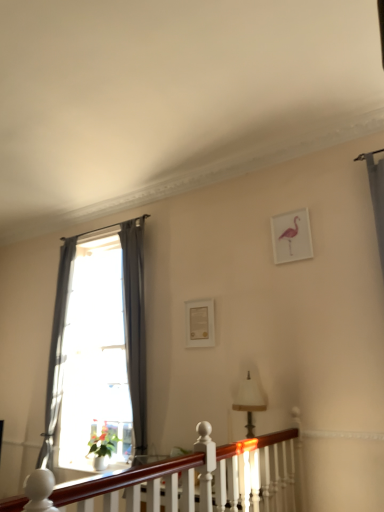
Describe the element at coordinates (103, 443) in the screenshot. Image resolution: width=384 pixels, height=512 pixels. I see `green matte flower at lower left` at that location.

Measure the distance between point (309,252) and camera.

The depth of point (309,252) is 3.41 meters.

Identify the location of matte white picture frame at center, which ranks as the 1th picture frame in back-to-front order. (199, 323).

What do you see at coordinates (98, 347) in the screenshot? The image size is (384, 512). I see `transparent glass window at left` at bounding box center [98, 347].

This screenshot has width=384, height=512. What are the coordinates of `white fabric lampshade at center` in the screenshot? It's located at (249, 402).

Measure the distance between white fabric lampshade at center and camera.

They are 3.19 meters apart.

Locate an element on the screen. The image size is (384, 512). gray fabric curtain at left, which is counted as the 2th curtain, starting from the left is located at coordinates (135, 325).

Considering the sizes of pink matte picture frame at upper right, which is the 2th picture frame from left to right, and transparent glass window at left in the image, is pink matte picture frame at upper right, which is the 2th picture frame from left to right, wider or thinner than transparent glass window at left?

In the image, pink matte picture frame at upper right, which is the 2th picture frame from left to right, appears to be more narrow than transparent glass window at left.

Is pink matte picture frame at upper right, the 1th picture frame in the front-to-back sequence, positioned behind transparent glass window at left?

No, pink matte picture frame at upper right, the 1th picture frame in the front-to-back sequence, is closer to the viewer.

Where is `the 2nd picture frame above the transparent glass window at left (from the image's perspective)`? The height and width of the screenshot is (512, 384). the 2nd picture frame above the transparent glass window at left (from the image's perspective) is located at coordinates (291, 236).

From the image's perspective, who appears lower, mahogany wood balustrade at lower center or gray fabric curtain at left, the 1th curtain when ordered from left to right?

mahogany wood balustrade at lower center appears lower in the image.

Which curtain is the 2nd one when counting from the back of the mahogany wood balustrade at lower center? Please provide its 2D coordinates.

[(57, 353)]

From a real-world perspective, is mahogany wood balustrade at lower center located beneath gray fabric curtain at left, the 1th curtain when ordered from left to right?

Yes, from a real-world perspective, mahogany wood balustrade at lower center is beneath gray fabric curtain at left, the 1th curtain when ordered from left to right.

Between mahogany wood balustrade at lower center and pink matte picture frame at upper right, the 1th picture frame in the front-to-back sequence, which one has larger size?

Bigger between the two is mahogany wood balustrade at lower center.

Which object is further away from the camera taking this photo, mahogany wood balustrade at lower center or pink matte picture frame at upper right, placed as the 1th picture frame when sorted from right to left?

pink matte picture frame at upper right, placed as the 1th picture frame when sorted from right to left, is further away from the camera.

Image resolution: width=384 pixels, height=512 pixels. I want to click on the 1st picture frame behind the mahogany wood balustrade at lower center, counting from the anchor's position, so click(291, 236).

Are green matte flower at lower left and transparent glass window at left far apart?

They are positioned close to each other.

Is point (110, 435) closer to viewer compared to point (111, 309)?

Yes, it is in front of point (111, 309).

Is green matte flower at lower left bigger or smaller than transparent glass window at left?

Clearly, green matte flower at lower left is smaller in size than transparent glass window at left.

Which is behind, green matte flower at lower left or transparent glass window at left?

transparent glass window at left is further from the camera.

Does pink matte picture frame at upper right, the 1th picture frame in the front-to-back sequence, have a lesser height compared to gray fabric curtain at left, the second curtain in the right-to-left sequence?

Correct, pink matte picture frame at upper right, the 1th picture frame in the front-to-back sequence, is not as tall as gray fabric curtain at left, the second curtain in the right-to-left sequence.

Which is behind, point (282, 245) or point (74, 258)?

The point (74, 258) is behind.

How far apart are pink matte picture frame at upper right, the 1th picture frame in the front-to-back sequence, and gray fabric curtain at left, the 1th curtain when ordered from left to right?

pink matte picture frame at upper right, the 1th picture frame in the front-to-back sequence, is 9.21 feet away from gray fabric curtain at left, the 1th curtain when ordered from left to right.

Is pink matte picture frame at upper right, which ranks as the 2th picture frame in bottom-to-top order, inside or outside of gray fabric curtain at left, the second curtain in the right-to-left sequence?

pink matte picture frame at upper right, which ranks as the 2th picture frame in bottom-to-top order, is located beyond the bounds of gray fabric curtain at left, the second curtain in the right-to-left sequence.

Who is smaller, gray fabric curtain at left, the second curtain in the right-to-left sequence, or matte white picture frame at center, placed as the second picture frame when sorted from top to bottom?

With smaller size is matte white picture frame at center, placed as the second picture frame when sorted from top to bottom.

Is gray fabric curtain at left, the second curtain in the right-to-left sequence, not inside matte white picture frame at center, which is the second picture frame from right to left?

Yes, gray fabric curtain at left, the second curtain in the right-to-left sequence, is outside of matte white picture frame at center, which is the second picture frame from right to left.

Can you see gray fabric curtain at left, the 1th curtain when ordered from left to right, touching matte white picture frame at center, which ranks as the 1th picture frame in back-to-front order?

gray fabric curtain at left, the 1th curtain when ordered from left to right, and matte white picture frame at center, which ranks as the 1th picture frame in back-to-front order, are not in contact.

How far apart are gray fabric curtain at left, the 1th curtain when ordered from left to right, and pink matte picture frame at upper right, which ranks as the 2th picture frame in bottom-to-top order?

gray fabric curtain at left, the 1th curtain when ordered from left to right, and pink matte picture frame at upper right, which ranks as the 2th picture frame in bottom-to-top order, are 9.21 feet apart from each other.

Locate an element on the screen. This screenshot has width=384, height=512. the 2nd curtain behind the pink matte picture frame at upper right, which ranks as the 2th picture frame in bottom-to-top order, counting from the anchor's position is located at coordinates (57, 353).

Is gray fabric curtain at left, the 1th curtain when ordered from left to right, bigger than pink matte picture frame at upper right, the 1th picture frame positioned from the top?

Yes.

Considering the positions of points (51, 420) and (306, 255), is point (51, 420) farther from camera compared to point (306, 255)?

That is True.

What are the coordinates of `window below the pink matte picture frame at upper right, the 1th picture frame in the front-to-back sequence (from the image's perspective)` in the screenshot? It's located at (98, 347).

Where is `the 1st curtain located above the mahogany wood balustrade at lower center (from a real-world perspective)`? This screenshot has width=384, height=512. the 1st curtain located above the mahogany wood balustrade at lower center (from a real-world perspective) is located at coordinates (57, 353).

From the image, which object appears to be farther from transparent glass window at left, white fabric lampshade at center or matte white picture frame at center, marked as the first picture frame in a bottom-to-top arrangement?

The object further to transparent glass window at left is white fabric lampshade at center.

Which object lies nearer to the anchor point transparent glass window at left, mahogany wood balustrade at lower center or white fabric lampshade at center?

Based on the image, white fabric lampshade at center appears to be nearer to transparent glass window at left.

Which object lies nearer to the anchor point gray fabric curtain at left, the second curtain in the right-to-left sequence, gray fabric curtain at left, which is counted as the 2th curtain, starting from the left, or transparent glass window at left?

transparent glass window at left lies closer to gray fabric curtain at left, the second curtain in the right-to-left sequence, than the other object.

Looking at the image, which one is located closer to pink matte picture frame at upper right, which is the 2th picture frame from left to right, gray fabric curtain at left, acting as the 1th curtain starting from the right, or matte white picture frame at center, which is the first picture frame in left-to-right order?

matte white picture frame at center, which is the first picture frame in left-to-right order.

Looking at the image, which one is located closer to green matte flower at lower left, gray fabric curtain at left, which is counted as the 2th curtain, starting from the left, or gray fabric curtain at left, the 1th curtain when ordered from left to right?

The object closer to green matte flower at lower left is gray fabric curtain at left, which is counted as the 2th curtain, starting from the left.

Looking at the image, which one is located further to gray fabric curtain at left, acting as the 1th curtain starting from the right, transparent glass window at left or mahogany wood balustrade at lower center?

Among the two, mahogany wood balustrade at lower center is located further to gray fabric curtain at left, acting as the 1th curtain starting from the right.

Looking at the image, which one is located closer to mahogany wood balustrade at lower center, gray fabric curtain at left, acting as the 1th curtain starting from the right, or green matte flower at lower left?

gray fabric curtain at left, acting as the 1th curtain starting from the right, lies closer to mahogany wood balustrade at lower center than the other object.

Which object lies further to the anchor point green matte flower at lower left, white fabric lampshade at center or gray fabric curtain at left, acting as the 1th curtain starting from the right?

white fabric lampshade at center is further to green matte flower at lower left.

You are a GUI agent. You are given a task and a screenshot of the screen. Output one action in this format:
    pyautogui.click(x=<x>, y=<y>)
    Task: Click on the curtain between gray fabric curtain at left, acting as the 1th curtain starting from the right, and green matte flower at lower left vertically
    
    Given the screenshot: What is the action you would take?
    pyautogui.click(x=57, y=353)

At what (x,y) coordinates should I click in order to perform the action: click on lamp between mahogany wood balustrade at lower center and gray fabric curtain at left, the 1th curtain when ordered from left to right, from front to back. Please return your answer as a coordinate pair (x, y). Looking at the image, I should click on (249, 402).

What are the coordinates of `curtain positioned between mahogany wood balustrade at lower center and transparent glass window at left from near to far` in the screenshot? It's located at (135, 325).

The height and width of the screenshot is (512, 384). What are the coordinates of `lamp located between mahogany wood balustrade at lower center and green matte flower at lower left in the depth direction` in the screenshot? It's located at (249, 402).